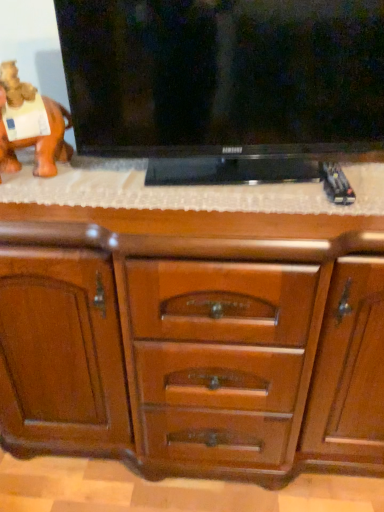
Question: Would you say wooden chest of drawers at center is inside or outside orange matte elephant at left?

Choices:
 (A) inside
 (B) outside

Answer: (B)

Question: Is wooden chest of drawers at center taller or shorter than orange matte elephant at left?

Choices:
 (A) short
 (B) tall

Answer: (B)

Question: Which object is positioned farthest from the wooden chest of drawers at center?

Choices:
 (A) orange matte elephant at left
 (B) black glossy flat-screen tv at upper center

Answer: (A)

Question: Considering the real-world distances, which object is farthest from the black glossy flat-screen tv at upper center?

Choices:
 (A) wooden chest of drawers at center
 (B) orange matte elephant at left

Answer: (B)